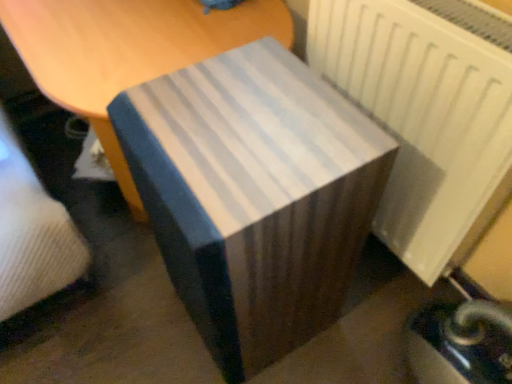
You are a GUI agent. You are given a task and a screenshot of the screen. Output one action in this format:
    pyautogui.click(x=<x>, y=<y>)
    Task: Click on the vacant region above blue striped fabric at center (from a real-world perspective)
    The image size is (512, 384).
    Given the screenshot: What is the action you would take?
    pyautogui.click(x=238, y=124)